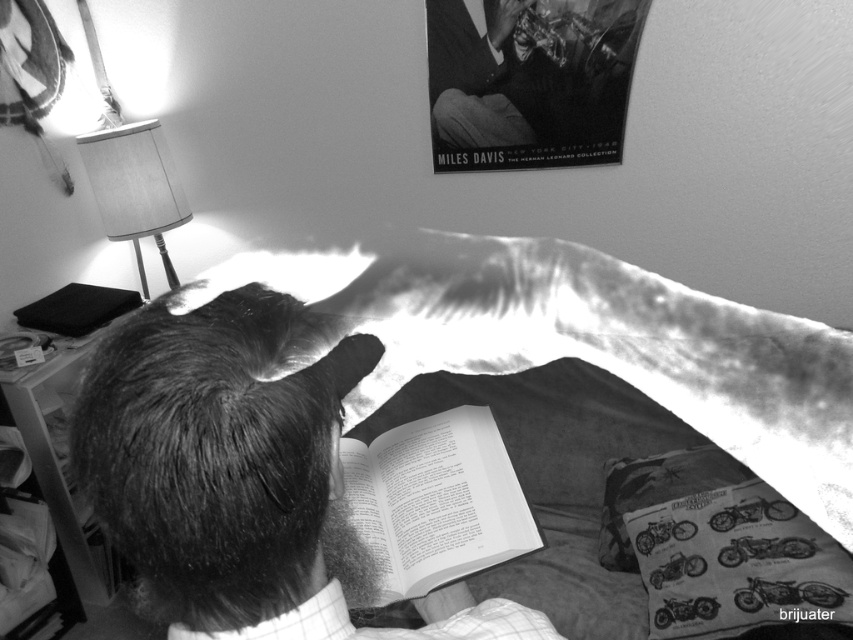
Question: Is dark hair at center to the right of matte fabric lampshade at upper left from the viewer's perspective?

Choices:
 (A) yes
 (B) no

Answer: (A)

Question: Among these objects, which one is farthest from the camera?

Choices:
 (A) printed paper book at lower center
 (B) paperback book at center
 (C) matte fabric lampshade at upper left
 (D) smooth skin at upper center

Answer: (C)

Question: Which point is closer to the camera taking this photo?

Choices:
 (A) (131, 225)
 (B) (247, 440)
 (C) (556, 65)

Answer: (B)

Question: Is smooth skin at upper center to the left of matte fabric lampshade at upper left from the viewer's perspective?

Choices:
 (A) yes
 (B) no

Answer: (B)

Question: Does paperback book at center appear under smooth skin at upper center?

Choices:
 (A) yes
 (B) no

Answer: (A)

Question: Which point is farther to the camera?

Choices:
 (A) metallic paper miles davis poster at upper center
 (B) matte fabric lampshade at upper left
 (C) paperback book at center

Answer: (B)